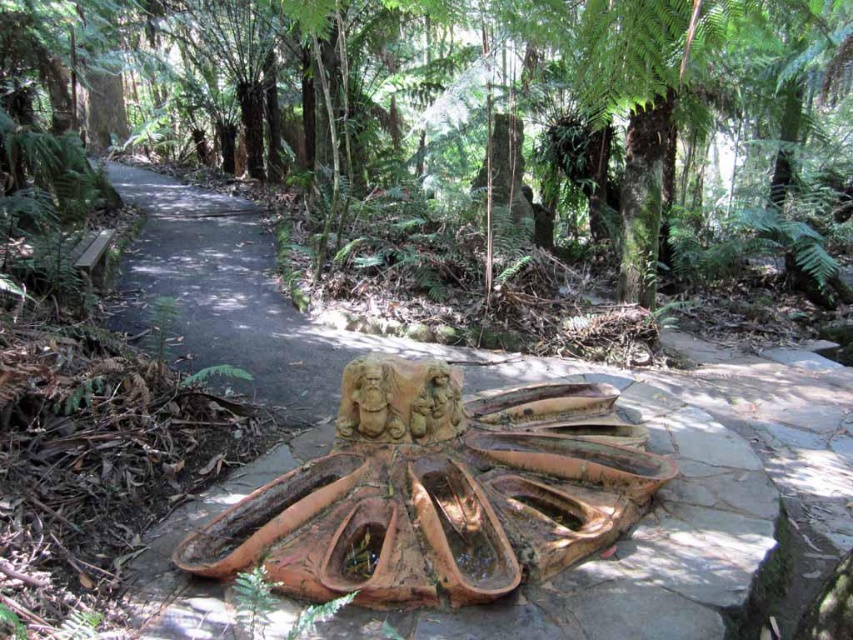
Which is above, green mossy tree at center or brown stone statue at center?

green mossy tree at center is higher up.

Describe the element at coordinates (476, 90) in the screenshot. I see `green mossy tree at center` at that location.

Does point (584, 67) come behind point (399, 371)?

Yes.

Locate an element on the screen. This screenshot has height=640, width=853. green mossy tree at center is located at coordinates (476, 90).

Which is above, green mossy tree at center or brown stone path at center?

green mossy tree at center is above.

Which is in front, point (834, 33) or point (793, 508)?

Positioned in front is point (793, 508).

I want to click on green mossy tree at center, so click(x=476, y=90).

Between green mossy tree at center and terracotta stone fountain at center, which one appears on the left side from the viewer's perspective?

green mossy tree at center is more to the left.

Who is more distant from viewer, (701, 61) or (323, 476)?

Positioned behind is point (701, 61).

Where is `green mossy tree at center`? The height and width of the screenshot is (640, 853). green mossy tree at center is located at coordinates (476, 90).